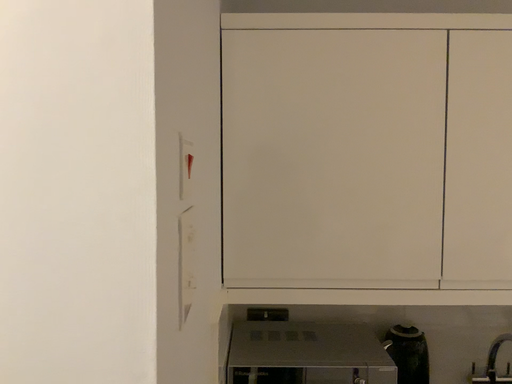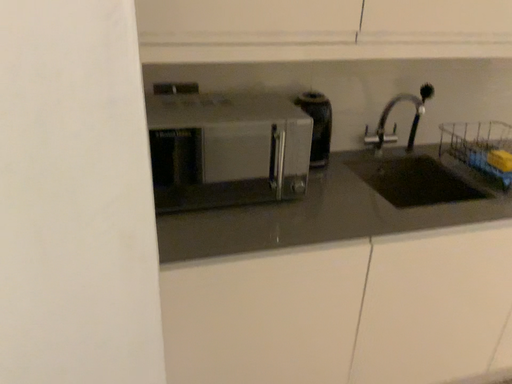
Question: How did the camera likely rotate when shooting the video?

Choices:
 (A) rotated right
 (B) rotated left

Answer: (A)